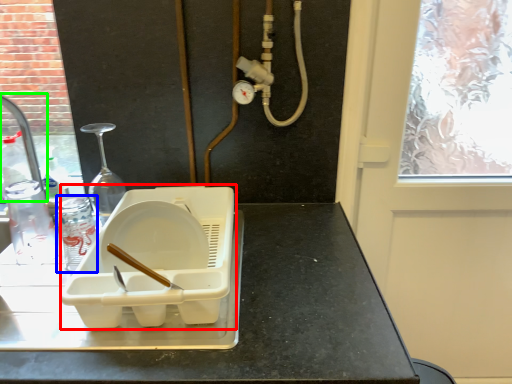
Question: Considering the real-world distances, which object is farthest from appliance (highlighted by a red box)? bottle (highlighted by a blue box) or faucet (highlighted by a green box)?

Choices:
 (A) bottle
 (B) faucet

Answer: (B)